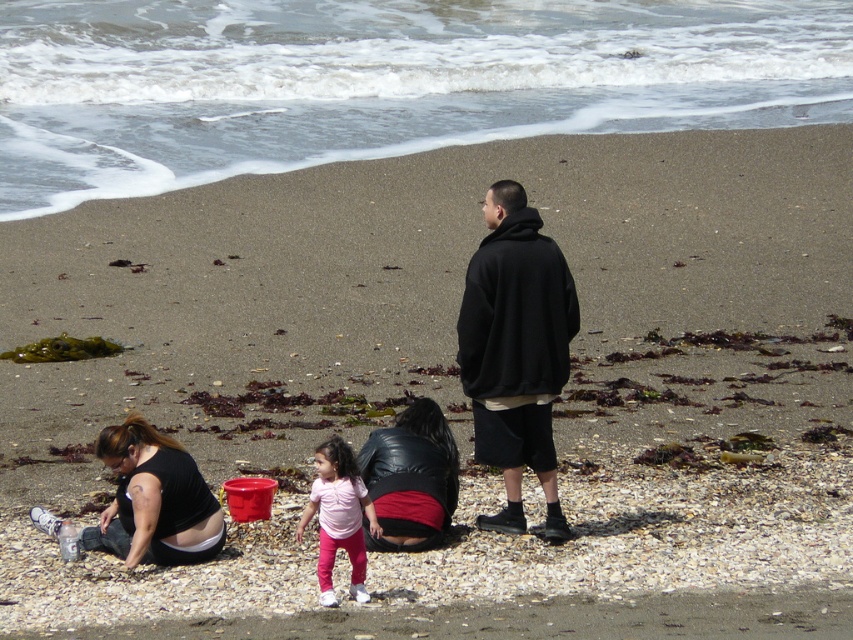
You are standing at the point labeled as point (515, 349) in the beach scene. What object are you touching?

The point (515, 349) is on the black matte hoodie at center, so you are touching the black matte hoodie at center.

You are a photographer trying to capture a candid shot of the two adults sitting on the beach. You notice the black matte hoodie at center and the pink matte pants at center in your viewfinder. Which object should you focus on to ensure the subject is in the foreground of your photo?

The black matte hoodie at center is above the pink matte pants at center, so focusing on the black matte hoodie at center will ensure the subject is in the foreground.

You are standing on the beach and want to reach the point marked at coordinates [537,280]. If you can walk 10 meters in 30 seconds, how long will it take you to get there?

The point marked at coordinates [537,280] is 9.93 meters away from you. At a walking speed of 10 meters per 30 seconds, it would take approximately 29.79 seconds to reach the point.